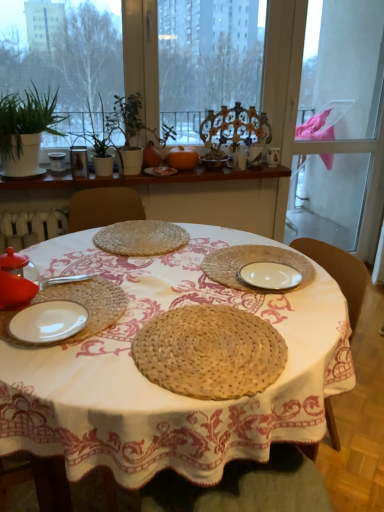
Where is `empty space that is in between white glossy plate at lower left, which is the fourth plate in back-to-front order, and matte glass teapot at left, the 1th tableware from the front`? This screenshot has height=512, width=384. empty space that is in between white glossy plate at lower left, which is the fourth plate in back-to-front order, and matte glass teapot at left, the 1th tableware from the front is located at coordinates (49, 304).